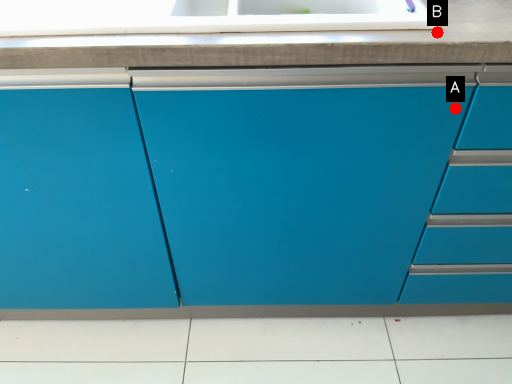
Question: Two points are circled on the image, labeled by A and B beside each circle. Which point appears closest to the camera in this image?

Choices:
 (A) A is closer
 (B) B is closer

Answer: (B)